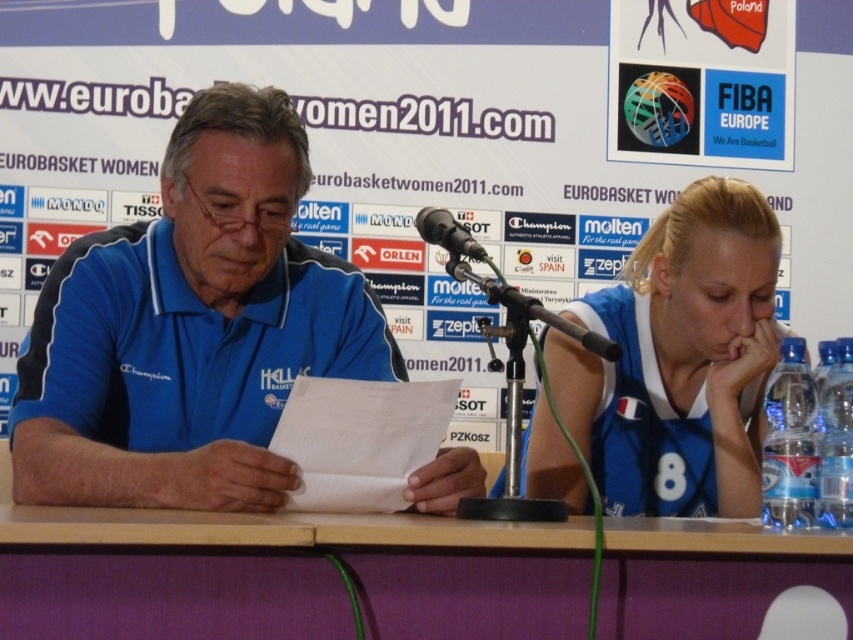
Question: Which point is closer to the camera?

Choices:
 (A) wooden table at center
 (B) blue jersey at right
 (C) blue jersey at center

Answer: (A)

Question: Among these points, which one is farthest from the camera?

Choices:
 (A) (700, 300)
 (B) (219, 147)
 (C) (456, 232)

Answer: (A)

Question: Does blue jersey at center have a smaller size compared to blue jersey at right?

Choices:
 (A) yes
 (B) no

Answer: (B)

Question: Can you confirm if wooden table at center is thinner than blue jersey at right?

Choices:
 (A) yes
 (B) no

Answer: (B)

Question: Which point is closer to the camera?

Choices:
 (A) black plastic microphone at center
 (B) wooden table at center

Answer: (B)

Question: Does blue jersey at center have a lesser width compared to black plastic microphone at center?

Choices:
 (A) yes
 (B) no

Answer: (B)